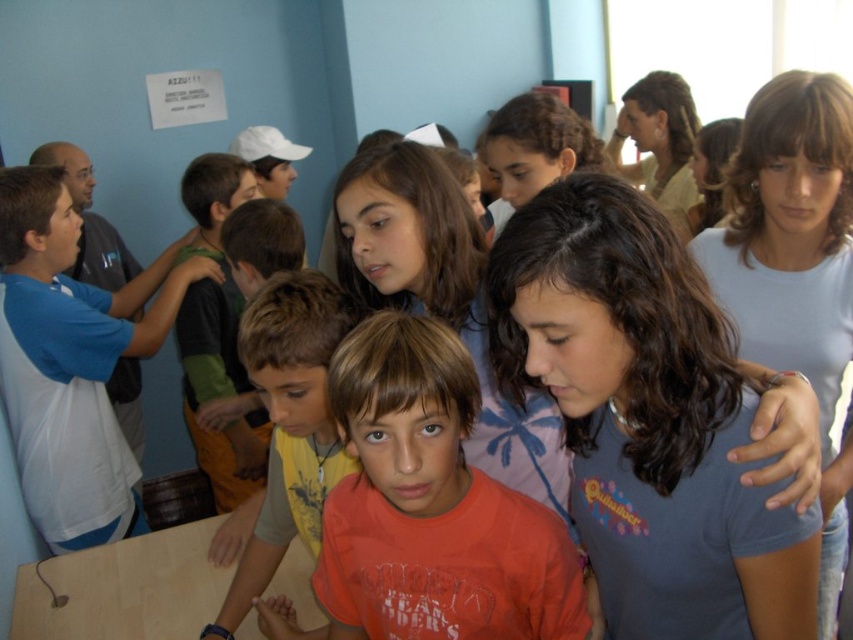
Question: Which of the following is the closest to the observer?

Choices:
 (A) orange t-shirt at center
 (B) blue cotton shirt at center
 (C) orange cotton shirt at center
 (D) light blue cotton shirt at center

Answer: (B)

Question: Is light blue cotton shirt at center positioned in front of orange t-shirt at center?

Choices:
 (A) yes
 (B) no

Answer: (B)

Question: Considering the real-world distances, which object is farthest from the green jersey at center?

Choices:
 (A) orange cotton shirt at center
 (B) orange t-shirt at center
 (C) blue cotton shirt at center

Answer: (C)

Question: Which point is closer to the camera taking this photo?

Choices:
 (A) (178, 292)
 (B) (291, 372)

Answer: (B)

Question: Is orange t-shirt at center below green jersey at center?

Choices:
 (A) no
 (B) yes

Answer: (B)

Question: Is white cotton shirt at left bigger than green jersey at center?

Choices:
 (A) no
 (B) yes

Answer: (B)